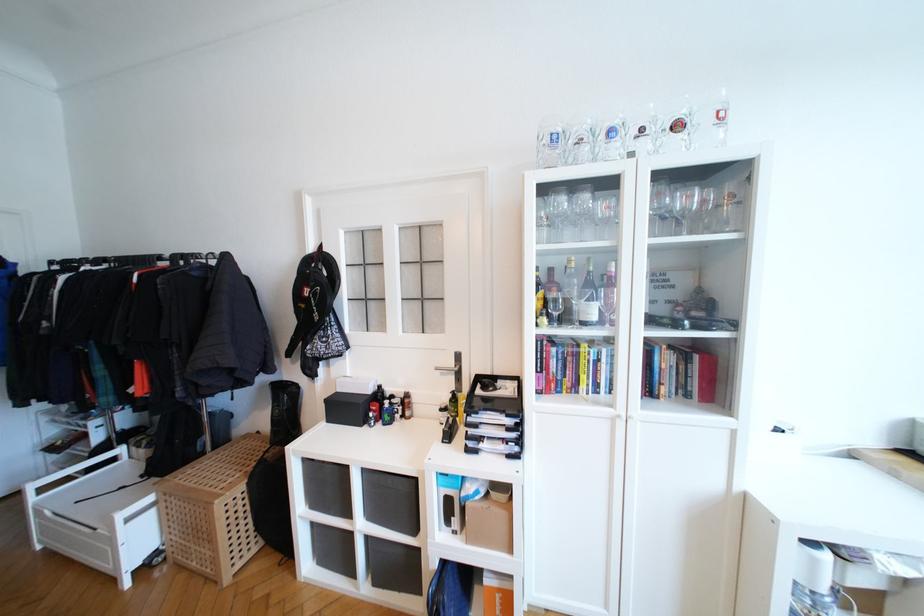
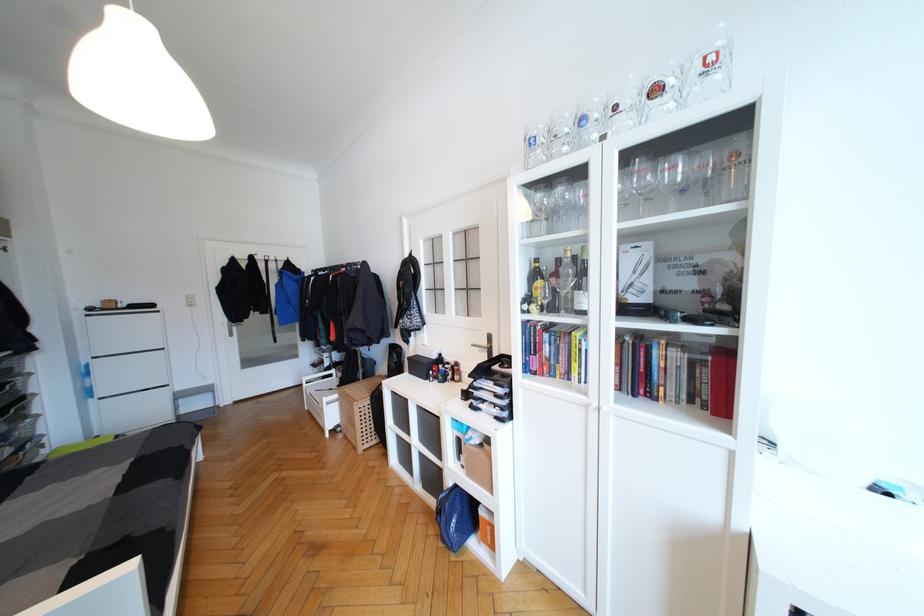
The point at (557, 138) is marked in the first image. Where is the corresponding point in the second image?

(536, 142)